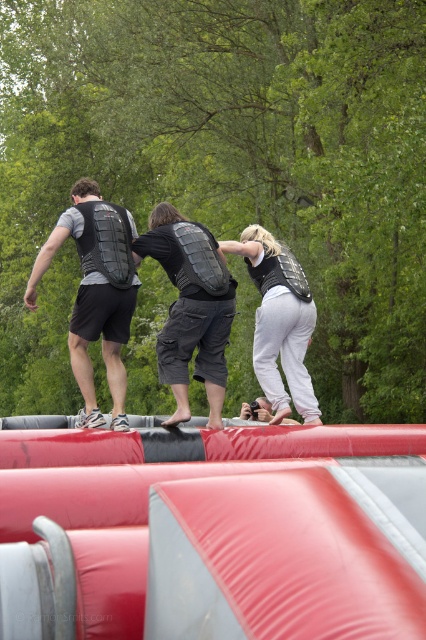
You are observing an outdoor inflatable obstacle course with two participants wearing vests. There is a black matte vest at center and a matte black vest at center. Which vest is closer to you?

The black matte vest at center is closer to the viewer than the matte black vest at center.

You are planning to place a safety sign on the inflatable obstacle course. The safety sign needs to be placed at the exact center of the inflatable structure. Currently, there is a black matte vest at center located at point 0.467, 0.319. Is the safety sign already placed correctly?

The black matte vest at center is located at point (135, 298), which indicates that the safety sign is already placed at the exact center of the inflatable structure.